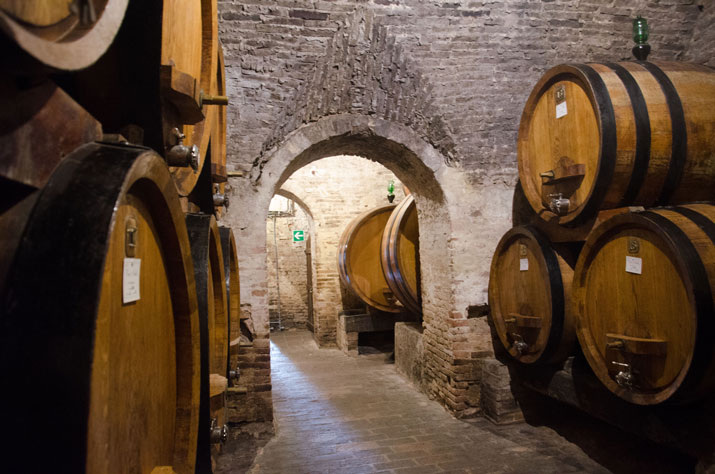
Where is `floor`? floor is located at coordinates [354, 422].